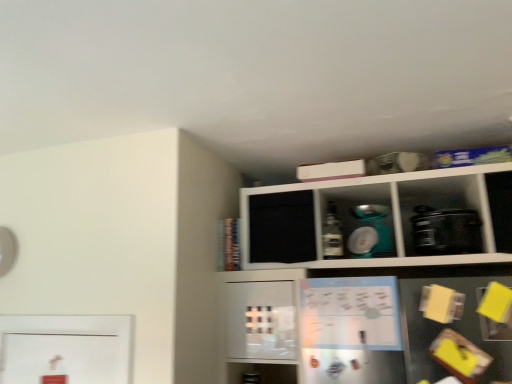
What do you see at coordinates (360, 278) in the screenshot? This screenshot has width=512, height=384. I see `white matte cabinet at upper center` at bounding box center [360, 278].

The image size is (512, 384). What do you see at coordinates (370, 232) in the screenshot?
I see `matte white bowl at upper center, which is the 1th appliance in left-to-right order` at bounding box center [370, 232].

At what (x,y) coordinates should I click in order to perform the action: click on white matte cabinet at upper center. Please return your answer as a coordinate pair (x, y). The image size is (512, 384). Looking at the image, I should click on (360, 278).

Is white matte cabinet at upper center facing away from black plastic toaster at right, placed as the 1th appliance when sorted from right to left?

Correct, white matte cabinet at upper center is looking away from black plastic toaster at right, placed as the 1th appliance when sorted from right to left.

Is white matte cabinet at upper center positioned far away from black plastic toaster at right, placed as the 1th appliance when sorted from right to left?

That's not correct — white matte cabinet at upper center is a little close to black plastic toaster at right, placed as the 1th appliance when sorted from right to left.

Who is shorter, white matte cabinet at upper center or black plastic toaster at right, placed as the 1th appliance when sorted from right to left?

black plastic toaster at right, placed as the 1th appliance when sorted from right to left.

Is white matte cabinet at upper center completely or partially outside of black plastic toaster at right, which is the 2th appliance from left to right?

white matte cabinet at upper center lies outside black plastic toaster at right, which is the 2th appliance from left to right,'s area.

The image size is (512, 384). What are the coordinates of `shelf below the black plastic toaster at right, placed as the 1th appliance when sorted from right to left (from a real-world perspective)` in the screenshot? It's located at (360, 278).

From the picture: Are black plastic toaster at right, which is the 2th appliance from left to right, and white matte cabinet at upper center beside each other?

black plastic toaster at right, which is the 2th appliance from left to right, and white matte cabinet at upper center are clearly separated.

From a real-world perspective, is black plastic toaster at right, which is the 2th appliance from left to right, on top of white matte cabinet at upper center?

Yes, from a real-world perspective, black plastic toaster at right, which is the 2th appliance from left to right, is over white matte cabinet at upper center

Could you tell me if black plastic toaster at right, placed as the 1th appliance when sorted from right to left, is turned towards white matte cabinet at upper center?

Yes.

Which object is positioned more to the right, matte plastic bottle at center or black plastic toaster at right, which is the 2th appliance from left to right?

black plastic toaster at right, which is the 2th appliance from left to right.

Considering the relative sizes of matte plastic bottle at center and black plastic toaster at right, placed as the 1th appliance when sorted from right to left, in the image provided, is matte plastic bottle at center taller than black plastic toaster at right, placed as the 1th appliance when sorted from right to left,?

Indeed, matte plastic bottle at center has a greater height compared to black plastic toaster at right, placed as the 1th appliance when sorted from right to left.

From a real-world perspective, between matte plastic bottle at center and black plastic toaster at right, which is the 2th appliance from left to right, who is vertically lower?

black plastic toaster at right, which is the 2th appliance from left to right, from a real-world perspective.

Which is in front, point (337, 248) or point (462, 230)?

The point (462, 230) is more forward.

Between white matte cabinet at upper center and matte white bowl at upper center, acting as the 2th appliance starting from the right, which one has smaller width?

With smaller width is matte white bowl at upper center, acting as the 2th appliance starting from the right.

Considering the relative positions of white matte cabinet at upper center and matte white bowl at upper center, which is the 1th appliance in left-to-right order, in the image provided, is white matte cabinet at upper center to the left or to the right of matte white bowl at upper center, which is the 1th appliance in left-to-right order,?

In the image, white matte cabinet at upper center appears on the right side of matte white bowl at upper center, which is the 1th appliance in left-to-right order.

From the image's perspective, would you say white matte cabinet at upper center is positioned over matte white bowl at upper center, which is the 1th appliance in left-to-right order?

Incorrect, from the image's perspective, white matte cabinet at upper center is lower than matte white bowl at upper center, which is the 1th appliance in left-to-right order.

Can you confirm if black plastic toaster at right, which is the 2th appliance from left to right, is wider than matte plastic bottle at center?

Indeed, black plastic toaster at right, which is the 2th appliance from left to right, has a greater width compared to matte plastic bottle at center.

What are the coordinates of `bottle on the left of the black plastic toaster at right, which is the 2th appliance from left to right` in the screenshot? It's located at (332, 234).

Does point (433, 220) appear closer or farther from the camera than point (328, 207)?

Clearly, point (433, 220) is closer to the camera than point (328, 207).

Who is shorter, black plastic toaster at right, placed as the 1th appliance when sorted from right to left, or matte plastic bottle at center?

Standing shorter between the two is black plastic toaster at right, placed as the 1th appliance when sorted from right to left.

You are a GUI agent. You are given a task and a screenshot of the screen. Output one action in this format:
    pyautogui.click(x=<x>, y=<y>)
    Task: Click on the bottle that appears on the left of white matte cabinet at upper center
    Image resolution: width=512 pixels, height=384 pixels.
    Given the screenshot: What is the action you would take?
    pyautogui.click(x=332, y=234)

Is matte plastic bottle at center taller or shorter than white matte cabinet at upper center?

matte plastic bottle at center is shorter than white matte cabinet at upper center.

What's the angular difference between matte plastic bottle at center and white matte cabinet at upper center's facing directions?

The facing directions of matte plastic bottle at center and white matte cabinet at upper center are 0.482 degrees apart.

From a real-world perspective, is matte plastic bottle at center physically located above or below white matte cabinet at upper center?

From a real-world perspective, matte plastic bottle at center is physically above white matte cabinet at upper center.

I want to click on appliance in front of the matte white bowl at upper center, which is the 1th appliance in left-to-right order, so click(x=445, y=231).

From the image's perspective, is matte white bowl at upper center, which is the 1th appliance in left-to-right order, positioned above or below black plastic toaster at right, placed as the 1th appliance when sorted from right to left?

matte white bowl at upper center, which is the 1th appliance in left-to-right order, is situated higher than black plastic toaster at right, placed as the 1th appliance when sorted from right to left, in the image.

Can we say matte white bowl at upper center, acting as the 2th appliance starting from the right, lies outside black plastic toaster at right, placed as the 1th appliance when sorted from right to left?

Yes, matte white bowl at upper center, acting as the 2th appliance starting from the right, is not within black plastic toaster at right, placed as the 1th appliance when sorted from right to left.

Considering the relative sizes of matte white bowl at upper center, which is the 1th appliance in left-to-right order, and black plastic toaster at right, placed as the 1th appliance when sorted from right to left, in the image provided, is matte white bowl at upper center, which is the 1th appliance in left-to-right order, shorter than black plastic toaster at right, placed as the 1th appliance when sorted from right to left,?

No.

Where is `shelf on the left side of black plastic toaster at right, placed as the 1th appliance when sorted from right to left`? The height and width of the screenshot is (384, 512). shelf on the left side of black plastic toaster at right, placed as the 1th appliance when sorted from right to left is located at coordinates (360, 278).

Identify the location of the 1st appliance above the white matte cabinet at upper center (from the image's perspective). (445, 231).

Consider the image. From the image, which object appears to be nearer to white matte cabinet at upper center, matte plastic bottle at center or matte white bowl at upper center, acting as the 2th appliance starting from the right?

matte white bowl at upper center, acting as the 2th appliance starting from the right, lies closer to white matte cabinet at upper center than the other object.

From the image, which object appears to be farther from matte white bowl at upper center, acting as the 2th appliance starting from the right, matte plastic bottle at center or white matte cabinet at upper center?

Based on the image, white matte cabinet at upper center appears to be further to matte white bowl at upper center, acting as the 2th appliance starting from the right.

Which object lies nearer to the anchor point matte white bowl at upper center, acting as the 2th appliance starting from the right, white matte cabinet at upper center or black plastic toaster at right, placed as the 1th appliance when sorted from right to left?

Among the two, black plastic toaster at right, placed as the 1th appliance when sorted from right to left, is located nearer to matte white bowl at upper center, acting as the 2th appliance starting from the right.

Considering their positions, is black plastic toaster at right, which is the 2th appliance from left to right, positioned further to white matte cabinet at upper center than matte white bowl at upper center, which is the 1th appliance in left-to-right order?

Among the two, black plastic toaster at right, which is the 2th appliance from left to right, is located further to white matte cabinet at upper center.

Considering their positions, is matte plastic bottle at center positioned closer to white matte cabinet at upper center than black plastic toaster at right, placed as the 1th appliance when sorted from right to left?

Among the two, black plastic toaster at right, placed as the 1th appliance when sorted from right to left, is located nearer to white matte cabinet at upper center.

Consider the image. From the image, which object appears to be farther from matte plastic bottle at center, black plastic toaster at right, which is the 2th appliance from left to right, or white matte cabinet at upper center?

black plastic toaster at right, which is the 2th appliance from left to right, is positioned further to the anchor matte plastic bottle at center.

Estimate the real-world distances between objects in this image. Which object is further from white matte cabinet at upper center, black plastic toaster at right, which is the 2th appliance from left to right, or matte plastic bottle at center?

matte plastic bottle at center.

From the image, which object appears to be farther from matte plastic bottle at center, white matte cabinet at upper center or black plastic toaster at right, placed as the 1th appliance when sorted from right to left?

black plastic toaster at right, placed as the 1th appliance when sorted from right to left, is positioned further to the anchor matte plastic bottle at center.

The image size is (512, 384). Find the location of `appliance located between white matte cabinet at upper center and matte plastic bottle at center in the depth direction`. appliance located between white matte cabinet at upper center and matte plastic bottle at center in the depth direction is located at coordinates (445, 231).

This screenshot has height=384, width=512. I want to click on appliance located between matte plastic bottle at center and black plastic toaster at right, which is the 2th appliance from left to right, in the left-right direction, so [370, 232].

Where is `bottle located between white matte cabinet at upper center and matte white bowl at upper center, which is the 1th appliance in left-to-right order, in the depth direction`? This screenshot has width=512, height=384. bottle located between white matte cabinet at upper center and matte white bowl at upper center, which is the 1th appliance in left-to-right order, in the depth direction is located at coordinates (332, 234).

The image size is (512, 384). I want to click on appliance between white matte cabinet at upper center and matte white bowl at upper center, which is the 1th appliance in left-to-right order, from front to back, so click(445, 231).